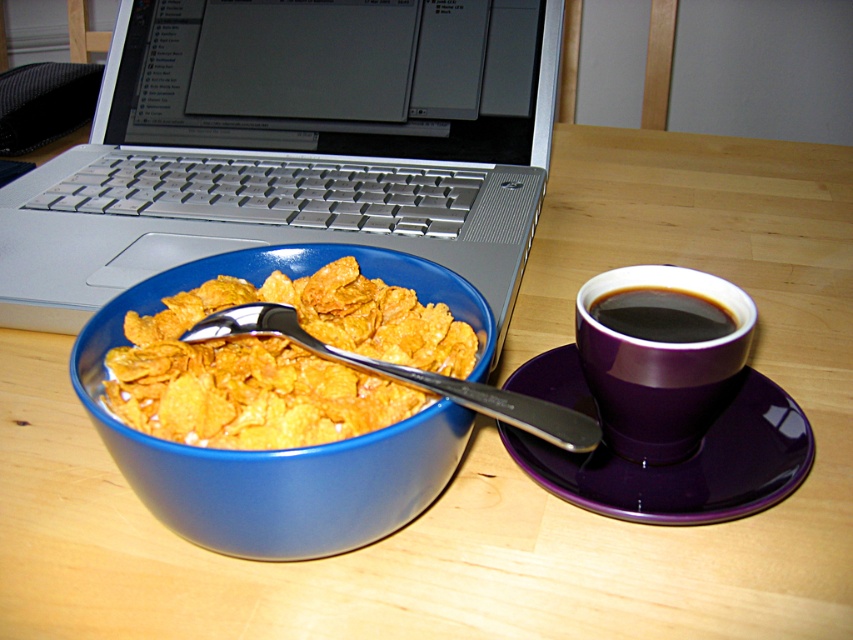
You are setting up a breakfast tray and need to place the purple glossy mug at upper right and the purple glossy saucer at right. According to the scene, which item is closer to you?

The purple glossy saucer at right is closer to you because the purple glossy mug at upper right is behind it.

Based on the photo, you have a small toy car that is 3 inches long. You want to place it between the silver metallic spoon at bowl center and the black glossy cup at right on the table. Will it fit without overlapping either object?

The silver metallic spoon at bowl center and black glossy cup at right are 3.20 inches apart. Since the toy car is 3 inches long, it will fit between them without overlapping either object because the distance between the two items is slightly larger than the car.

You are setting up a breakfast tray and need to stack the purple glossy saucer at right and the purple glossy mug at upper right. Which item should go on the bottom to ensure stability?

The purple glossy saucer at right should be placed on the bottom because it has a lesser height compared to the purple glossy mug at upper right, providing a stable base.